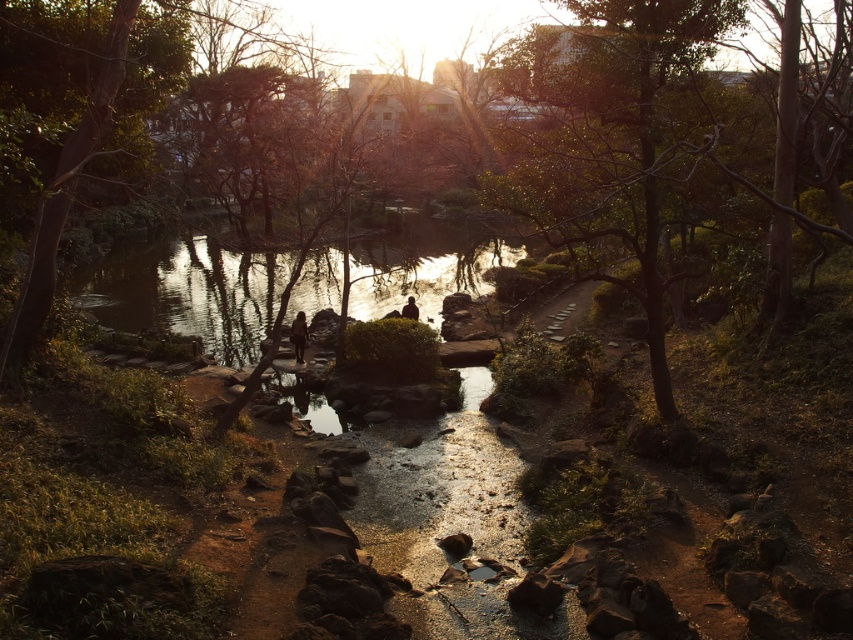
You are standing on the dirt path and want to take a photo of the silhouette figure at center. The green leafy tree at upper center is blocking your view. Can you move to the left or right to get a clear shot without the tree in the way?

The green leafy tree at upper center is much taller than the silhouette figure at center, so moving to the left or right might not help since the tree is blocking the view. You might need to move closer or find a different angle where the tree isn

From the picture: You are standing at the point labeled as point [299,336] in the image. What is the surface you are currently standing on?

The point [299,336] is on a brown textured rock at center, so you are standing on a brown textured rock.

Consider the image. You are standing on the dirt path and want to take a photo of the silhouette figure at center without the green leafy tree at upper center blocking the view. Is this possible?

The green leafy tree at upper center is above the silhouette figure at center, so if you position yourself directly in front of the silhouette figure at center, the tree would not block the view as it is positioned higher up.